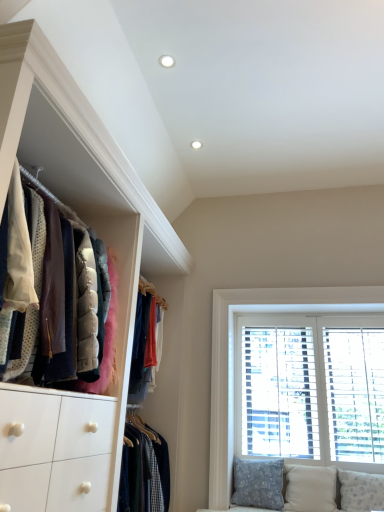
Measure the distance between point (320, 470) and camera.

The distance of point (320, 470) from camera is 9.84 feet.

This screenshot has height=512, width=384. In order to click on white wood window at right in this screenshot , I will do `click(233, 356)`.

This screenshot has height=512, width=384. What are the coordinates of `velvet jackets at left` in the screenshot? It's located at (57, 289).

What is the approximate height of patterned fabric pillow at lower right, the 1th pillow in the left-to-right sequence?

The height of patterned fabric pillow at lower right, the 1th pillow in the left-to-right sequence, is 15.76 inches.

In order to click on beige fabric pillow at lower right, the 2th pillow viewed from the right in this screenshot , I will do `click(310, 488)`.

Can velvet jackets at left be found inside patterned fabric pillow at lower right, the 3th pillow in the right-to-left sequence?

No, patterned fabric pillow at lower right, the 3th pillow in the right-to-left sequence, does not contain velvet jackets at left.

Is patterned fabric pillow at lower right, the 1th pillow in the left-to-right sequence, turned away from velvet jackets at left?

No, patterned fabric pillow at lower right, the 1th pillow in the left-to-right sequence, is not facing away from velvet jackets at left.

Locate an element on the screen. The image size is (384, 512). the 3rd pillow behind the velvet jackets at left is located at coordinates (258, 483).

Does white textured pillow at lower right, the first pillow positioned from the right, touch velvet jackets at left?

There is a gap between white textured pillow at lower right, the first pillow positioned from the right, and velvet jackets at left.

From a real-world perspective, who is located higher, white textured pillow at lower right, acting as the third pillow starting from the left, or velvet jackets at left?

velvet jackets at left is physically above.

Looking at this image, considering their positions, is white textured pillow at lower right, the first pillow positioned from the right, located in front of or behind velvet jackets at left?

white textured pillow at lower right, the first pillow positioned from the right, is behind velvet jackets at left.

In terms of width, does white textured pillow at lower right, the first pillow positioned from the right, look wider or thinner when compared to velvet jackets at left?

Clearly, white textured pillow at lower right, the first pillow positioned from the right, has less width compared to velvet jackets at left.

Is velvet jackets at left wider than white textured pillow at lower right, acting as the third pillow starting from the left?

Yes.

Does point (90, 331) appear closer or farther from the camera than point (383, 475)?

Point (90, 331).

Is velvet jackets at left in front of or behind white textured pillow at lower right, the first pillow positioned from the right, in the image?

Visually, velvet jackets at left is located in front of white textured pillow at lower right, the first pillow positioned from the right.

Does point (212, 387) appear closer or farther from the camera than point (289, 474)?

Point (212, 387) is farther from the camera than point (289, 474).

Is white wood window at right not inside beige fabric pillow at lower right, the second pillow when ordered from left to right?

white wood window at right lies outside beige fabric pillow at lower right, the second pillow when ordered from left to right,'s area.

How many degrees apart are the facing directions of white wood window at right and beige fabric pillow at lower right, the second pillow when ordered from left to right?

The angle between the facing direction of white wood window at right and the facing direction of beige fabric pillow at lower right, the second pillow when ordered from left to right, is 0.278 degrees.

Who is smaller, white wood window at right or beige fabric pillow at lower right, the 2th pillow viewed from the right?

Smaller between the two is beige fabric pillow at lower right, the 2th pillow viewed from the right.

Identify the location of closet located in front of the white wood window at right. The width and height of the screenshot is (384, 512). (x=57, y=289).

In terms of width, does velvet jackets at left look wider or thinner when compared to white wood window at right?

Considering their sizes, velvet jackets at left looks broader than white wood window at right.

Considering the sizes of objects velvet jackets at left and white wood window at right in the image provided, who is bigger, velvet jackets at left or white wood window at right?

With larger size is velvet jackets at left.

Is velvet jackets at left not near white wood window at right?

That's right, there is a large distance between velvet jackets at left and white wood window at right.

Based on their positions, is white textured pillow at lower right, the first pillow positioned from the right, located to the left or right of white wood window at right?

Based on their positions, white textured pillow at lower right, the first pillow positioned from the right, is located to the right of white wood window at right.

Which is less distant, (x=363, y=475) or (x=218, y=327)?

Point (x=363, y=475)

Considering the sizes of white textured pillow at lower right, acting as the third pillow starting from the left, and white wood window at right in the image, is white textured pillow at lower right, acting as the third pillow starting from the left, wider or thinner than white wood window at right?

Clearly, white textured pillow at lower right, acting as the third pillow starting from the left, has more width compared to white wood window at right.

Locate an element on the screen. Image resolution: width=384 pixels, height=512 pixels. window lying on the left of white textured pillow at lower right, acting as the third pillow starting from the left is located at coordinates (233, 356).

What are the coordinates of `pillow that is the 2nd object to the left of the white wood window at right, starting at the anchor` in the screenshot? It's located at (258, 483).

From a real-world perspective, is white wood window at right under patterned fabric pillow at lower right, the 3th pillow in the right-to-left sequence?

No, from a real-world perspective, white wood window at right is not below patterned fabric pillow at lower right, the 3th pillow in the right-to-left sequence.

Is white wood window at right bigger or smaller than patterned fabric pillow at lower right, the 3th pillow in the right-to-left sequence?

Considering their sizes, white wood window at right takes up more space than patterned fabric pillow at lower right, the 3th pillow in the right-to-left sequence.

In order to click on closet above the patterned fabric pillow at lower right, the 3th pillow in the right-to-left sequence (from the image's perspective) in this screenshot , I will do `click(57, 289)`.

Locate an element on the screen. closet on the left side of white textured pillow at lower right, the first pillow positioned from the right is located at coordinates (57, 289).

Estimate the real-world distances between objects in this image. Which object is closer to velvet jackets at left, white wood window at right or patterned fabric pillow at lower right, the 1th pillow in the left-to-right sequence?

white wood window at right is closer to velvet jackets at left.

Based on their spatial positions, is white wood window at right or white textured pillow at lower right, acting as the third pillow starting from the left, closer to patterned fabric pillow at lower right, the 1th pillow in the left-to-right sequence?

Based on the image, white wood window at right appears to be nearer to patterned fabric pillow at lower right, the 1th pillow in the left-to-right sequence.

Estimate the real-world distances between objects in this image. Which object is further from velvet jackets at left, patterned fabric pillow at lower right, the 3th pillow in the right-to-left sequence, or white textured pillow at lower right, the first pillow positioned from the right?

white textured pillow at lower right, the first pillow positioned from the right.

From the image, which object appears to be farther from white wood window at right, velvet jackets at left or beige fabric pillow at lower right, the 2th pillow viewed from the right?

velvet jackets at left is further to white wood window at right.

Considering their positions, is beige fabric pillow at lower right, the 2th pillow viewed from the right, positioned closer to white wood window at right than velvet jackets at left?

beige fabric pillow at lower right, the 2th pillow viewed from the right, is positioned closer to the anchor white wood window at right.

From the image, which object appears to be farther from white textured pillow at lower right, acting as the third pillow starting from the left, patterned fabric pillow at lower right, the 3th pillow in the right-to-left sequence, or white wood window at right?

The object further to white textured pillow at lower right, acting as the third pillow starting from the left, is white wood window at right.

Considering their positions, is white textured pillow at lower right, the first pillow positioned from the right, positioned closer to velvet jackets at left than white wood window at right?

white wood window at right.

Estimate the real-world distances between objects in this image. Which object is further from beige fabric pillow at lower right, the second pillow when ordered from left to right, patterned fabric pillow at lower right, the 1th pillow in the left-to-right sequence, or white textured pillow at lower right, the first pillow positioned from the right?

Among the two, white textured pillow at lower right, the first pillow positioned from the right, is located further to beige fabric pillow at lower right, the second pillow when ordered from left to right.

The image size is (384, 512). Find the location of `window situated between velvet jackets at left and white textured pillow at lower right, the first pillow positioned from the right, from left to right`. window situated between velvet jackets at left and white textured pillow at lower right, the first pillow positioned from the right, from left to right is located at coordinates (233, 356).

Find the location of a particular element. This screenshot has width=384, height=512. pillow located between patterned fabric pillow at lower right, the 1th pillow in the left-to-right sequence, and white textured pillow at lower right, acting as the third pillow starting from the left, in the left-right direction is located at coordinates (310, 488).

Find the location of `window situated between patterned fabric pillow at lower right, the 3th pillow in the right-to-left sequence, and white textured pillow at lower right, acting as the third pillow starting from the left, from left to right`. window situated between patterned fabric pillow at lower right, the 3th pillow in the right-to-left sequence, and white textured pillow at lower right, acting as the third pillow starting from the left, from left to right is located at coordinates (233, 356).